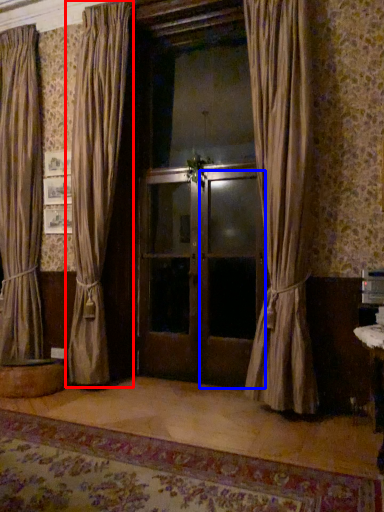
Question: Which point is further to the camera, curtain (highlighted by a red box) or screen door (highlighted by a blue box)?

Choices:
 (A) curtain
 (B) screen door

Answer: (B)